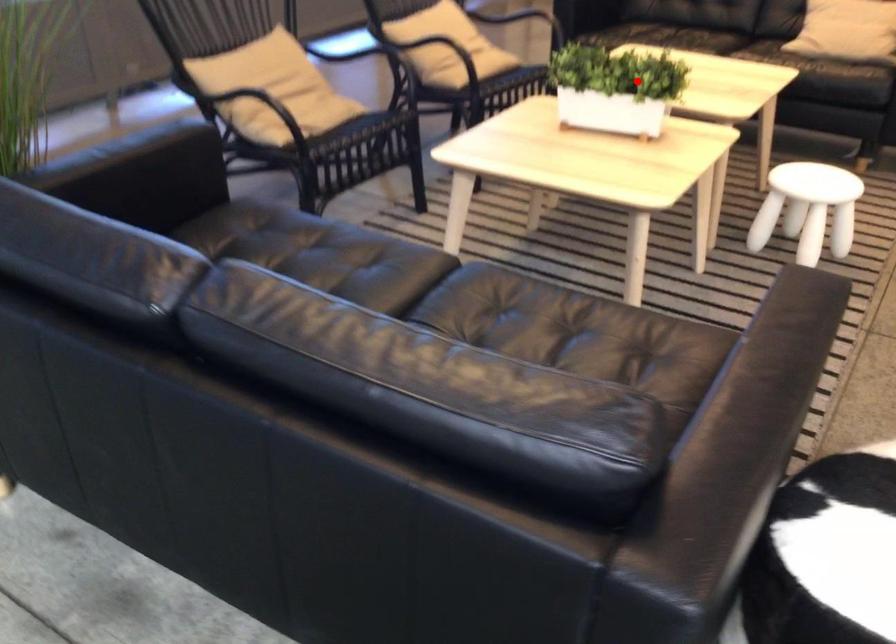
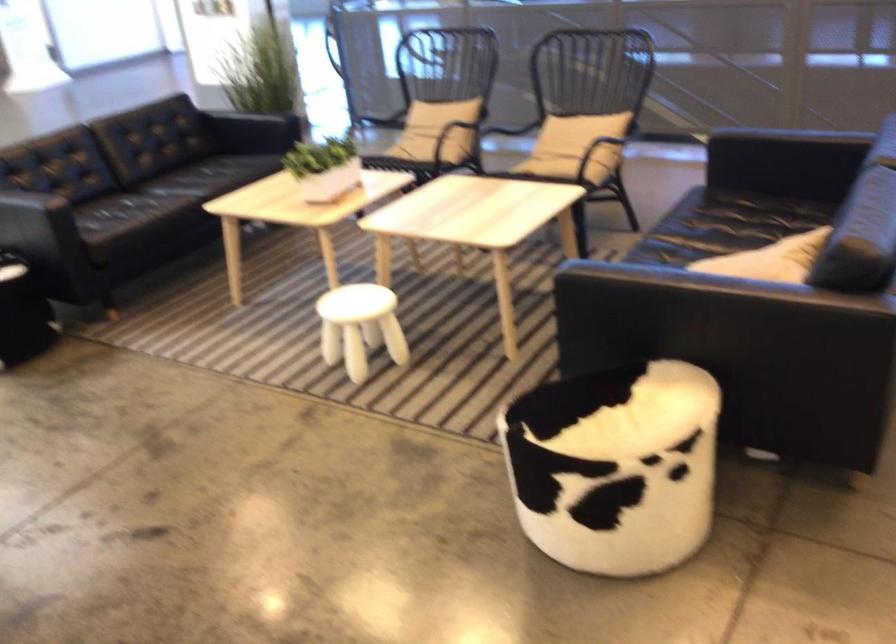
In the second image, find the point that corresponds to the highlighted location in the first image.

(323, 167)